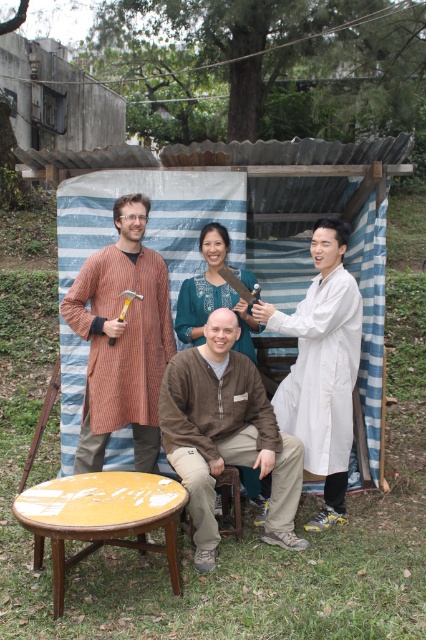
Question: Among these objects, which one is farthest from the camera?

Choices:
 (A) white lab coat at right
 (B) striped cotton robe at left
 (C) brown cotton shirt at center
 (D) yellow painted wood stool at lower center

Answer: (B)

Question: Which point appears closest to the camera in this image?

Choices:
 (A) (224, 486)
 (B) (86, 332)
 (C) (259, 401)
 (D) (313, 314)

Answer: (D)

Question: Is the position of white lab coat at right less distant than that of yellow painted wood stool at lower center?

Choices:
 (A) yes
 (B) no

Answer: (B)

Question: Is striped cotton robe at left below yellow painted wood stool at lower center?

Choices:
 (A) no
 (B) yes

Answer: (A)

Question: Is white lab coat at right positioned in front of yellow painted wood stool at lower center?

Choices:
 (A) no
 (B) yes

Answer: (A)

Question: Which object appears farthest from the camera in this image?

Choices:
 (A) white lab coat at right
 (B) brown cotton shirt at center
 (C) blue embroidered blouse at center

Answer: (C)